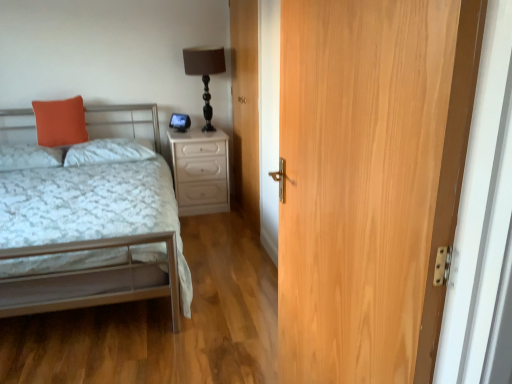
This screenshot has height=384, width=512. What do you see at coordinates (60, 122) in the screenshot? I see `orange matte pillow at upper left, arranged as the 2th pillow when viewed from the right` at bounding box center [60, 122].

I want to click on orange fabric pillow at left, placed as the 1th pillow when sorted from left to right, so click(29, 156).

The image size is (512, 384). Identify the location of light brown wood door at right, acting as the 1th door starting from the front. (370, 181).

Describe the element at coordinates (370, 181) in the screenshot. This screenshot has width=512, height=384. I see `light brown wood door at right, the second door from the left` at that location.

This screenshot has height=384, width=512. I want to click on white glossy nightstand at center, so click(200, 171).

I want to click on orange fabric pillow at left, the 3th pillow when ordered from left to right, so 106,152.

This screenshot has width=512, height=384. I want to click on matte black table lamp at upper center, so click(205, 73).

In order to click on orange matte pillow at upper left, marked as the second pillow in a left-to-right arrangement in this screenshot , I will do `click(60, 122)`.

From a real-world perspective, who is located lower, white glossy nightstand at center or orange fabric pillow at left, placed as the 1th pillow when sorted from left to right?

white glossy nightstand at center is physically lower.

Is white glossy nightstand at center positioned with its back to orange fabric pillow at left, placed as the 1th pillow when sorted from left to right?

No, white glossy nightstand at center is not facing away from orange fabric pillow at left, placed as the 1th pillow when sorted from left to right.

From the image's perspective, which one is positioned higher, white glossy nightstand at center or orange fabric pillow at left, placed as the 1th pillow when sorted from left to right?

From the image's view, orange fabric pillow at left, placed as the 1th pillow when sorted from left to right, is above.

Is white glossy nightstand at center not close to orange fabric pillow at left, placed as the 1th pillow when sorted from left to right?

That's right, there is a large distance between white glossy nightstand at center and orange fabric pillow at left, placed as the 1th pillow when sorted from left to right.

Is white glossy nightstand at center not near metallic silver bed at left?

Yes, white glossy nightstand at center and metallic silver bed at left are located far from each other.

Based on their sizes in the image, would you say white glossy nightstand at center is bigger or smaller than metallic silver bed at left?

Considering their sizes, white glossy nightstand at center takes up less space than metallic silver bed at left.

Can we say white glossy nightstand at center lies outside metallic silver bed at left?

white glossy nightstand at center lies outside metallic silver bed at left's area.

From a real-world perspective, which is physically below, white glossy nightstand at center or metallic silver bed at left?

white glossy nightstand at center is physically lower.

From a real-world perspective, between white glossy nightstand at center and light brown wood door at right, the second door from the back, who is vertically higher?

light brown wood door at right, the second door from the back.

Does point (180, 186) come closer to viewer compared to point (417, 288)?

That is False.

Is white glossy nightstand at center to the left of light brown wood door at right, acting as the 1th door starting from the front, from the viewer's perspective?

Yes, white glossy nightstand at center is to the left of light brown wood door at right, acting as the 1th door starting from the front.

Consider the image. Looking at the image, does metallic silver bed at left seem bigger or smaller compared to matte black table lamp at upper center?

In the image, metallic silver bed at left appears to be larger than matte black table lamp at upper center.

Are metallic silver bed at left and matte black table lamp at upper center located far from each other?

metallic silver bed at left is far away from matte black table lamp at upper center.

Is metallic silver bed at left wider than matte black table lamp at upper center?

Correct, the width of metallic silver bed at left exceeds that of matte black table lamp at upper center.

From a real-world perspective, which is physically above, metallic silver bed at left or matte black table lamp at upper center?

matte black table lamp at upper center is physically above.

From the image's perspective, is matte black table lamp at upper center located above or below orange matte pillow at upper left, arranged as the 2th pillow when viewed from the right?

matte black table lamp at upper center is situated higher than orange matte pillow at upper left, arranged as the 2th pillow when viewed from the right, in the image.

Is point (210, 59) closer or farther from the camera than point (44, 102)?

Point (210, 59).

Is orange matte pillow at upper left, arranged as the 2th pillow when viewed from the right, completely or partially inside matte black table lamp at upper center?

No, orange matte pillow at upper left, arranged as the 2th pillow when viewed from the right, is located outside of matte black table lamp at upper center.

From the picture: Between matte black table lamp at upper center and orange matte pillow at upper left, arranged as the 2th pillow when viewed from the right, which one has less height?

With less height is orange matte pillow at upper left, arranged as the 2th pillow when viewed from the right.

Between orange fabric pillow at left, arranged as the third pillow when viewed from the right, and metallic silver bed at left, which one is positioned behind?

orange fabric pillow at left, arranged as the third pillow when viewed from the right, is more distant.

From the image's perspective, is orange fabric pillow at left, placed as the 1th pillow when sorted from left to right, located above or below metallic silver bed at left?

Clearly, from the image's perspective, orange fabric pillow at left, placed as the 1th pillow when sorted from left to right, is above metallic silver bed at left.

Would you consider orange fabric pillow at left, placed as the 1th pillow when sorted from left to right, to be distant from metallic silver bed at left?

No, there isn't a large distance between orange fabric pillow at left, placed as the 1th pillow when sorted from left to right, and metallic silver bed at left.

Is orange fabric pillow at left, placed as the 1th pillow when sorted from left to right, taller than metallic silver bed at left?

Incorrect, the height of orange fabric pillow at left, placed as the 1th pillow when sorted from left to right, is not larger of that of metallic silver bed at left.

Are orange fabric pillow at left, marked as the first pillow in a right-to-left arrangement, and metallic silver bed at left making contact?

No, orange fabric pillow at left, marked as the first pillow in a right-to-left arrangement, is not touching metallic silver bed at left.

Is orange fabric pillow at left, marked as the first pillow in a right-to-left arrangement, situated inside metallic silver bed at left or outside?

The correct answer is: inside.

Considering the relative sizes of orange fabric pillow at left, marked as the first pillow in a right-to-left arrangement, and metallic silver bed at left in the image provided, is orange fabric pillow at left, marked as the first pillow in a right-to-left arrangement, taller than metallic silver bed at left?

No.

Is orange fabric pillow at left, marked as the first pillow in a right-to-left arrangement, smaller than metallic silver bed at left?

Indeed, orange fabric pillow at left, marked as the first pillow in a right-to-left arrangement, has a smaller size compared to metallic silver bed at left.

Locate an element on the screen. the 3rd pillow in front when counting from the white glossy nightstand at center is located at coordinates (29, 156).

At what (x,y) coordinates should I click in order to perform the action: click on bed positioned vertically above the white glossy nightstand at center (from a real-world perspective). Please return your answer as a coordinate pair (x, y). Image resolution: width=512 pixels, height=384 pixels. Looking at the image, I should click on (90, 239).

When comparing their distances from orange fabric pillow at left, marked as the first pillow in a right-to-left arrangement, does light brown wood door at center, which is the 1th door in left-to-right order, or orange matte pillow at upper left, arranged as the 2th pillow when viewed from the right, seem further?

light brown wood door at center, which is the 1th door in left-to-right order, is positioned further to the anchor orange fabric pillow at left, marked as the first pillow in a right-to-left arrangement.

Considering their positions, is light brown wood door at right, the second door from the left, positioned closer to orange fabric pillow at left, arranged as the third pillow when viewed from the right, than orange fabric pillow at left, the 3th pillow when ordered from left to right?

The object closer to orange fabric pillow at left, arranged as the third pillow when viewed from the right, is orange fabric pillow at left, the 3th pillow when ordered from left to right.

Considering their positions, is orange matte pillow at upper left, marked as the second pillow in a left-to-right arrangement, positioned closer to orange fabric pillow at left, the 3th pillow when ordered from left to right, than orange fabric pillow at left, arranged as the third pillow when viewed from the right?

orange matte pillow at upper left, marked as the second pillow in a left-to-right arrangement, is positioned closer to the anchor orange fabric pillow at left, the 3th pillow when ordered from left to right.

When comparing their distances from light brown wood door at right, the second door from the back, does orange fabric pillow at left, marked as the first pillow in a right-to-left arrangement, or matte black table lamp at upper center seem further?

matte black table lamp at upper center lies further to light brown wood door at right, the second door from the back, than the other object.

When comparing their distances from light brown wood door at center, the 2th door when ordered from right to left, does matte black table lamp at upper center or orange fabric pillow at left, marked as the first pillow in a right-to-left arrangement, seem closer?

matte black table lamp at upper center lies closer to light brown wood door at center, the 2th door when ordered from right to left, than the other object.

Based on their spatial positions, is white glossy nightstand at center or orange fabric pillow at left, placed as the 1th pillow when sorted from left to right, closer to metallic silver bed at left?

orange fabric pillow at left, placed as the 1th pillow when sorted from left to right, lies closer to metallic silver bed at left than the other object.

Which object lies nearer to the anchor point metallic silver bed at left, light brown wood door at right, which is the 1th door from right to left, or orange matte pillow at upper left, arranged as the 2th pillow when viewed from the right?

orange matte pillow at upper left, arranged as the 2th pillow when viewed from the right.

Based on their spatial positions, is light brown wood door at right, the second door from the left, or orange fabric pillow at left, arranged as the third pillow when viewed from the right, further from matte black table lamp at upper center?

The object further to matte black table lamp at upper center is light brown wood door at right, the second door from the left.

I want to click on bed between light brown wood door at right, acting as the 1th door starting from the front, and white glossy nightstand at center, along the z-axis, so click(90, 239).

Where is `nightstand between orange fabric pillow at left, marked as the first pillow in a right-to-left arrangement, and light brown wood door at center, the 2th door when ordered from right to left, from left to right`? The width and height of the screenshot is (512, 384). nightstand between orange fabric pillow at left, marked as the first pillow in a right-to-left arrangement, and light brown wood door at center, the 2th door when ordered from right to left, from left to right is located at coordinates (200, 171).

This screenshot has height=384, width=512. Find the location of `table lamp between orange matte pillow at upper left, arranged as the 2th pillow when viewed from the right, and light brown wood door at center, which is the 1th door in left-to-right order, from left to right`. table lamp between orange matte pillow at upper left, arranged as the 2th pillow when viewed from the right, and light brown wood door at center, which is the 1th door in left-to-right order, from left to right is located at coordinates (205, 73).

You are a GUI agent. You are given a task and a screenshot of the screen. Output one action in this format:
    pyautogui.click(x=<x>, y=<y>)
    Task: Click on the bed located between light brown wood door at right, which is the 1th door from right to left, and orange fabric pillow at left, the 3th pillow when ordered from left to right, in the depth direction
    
    Given the screenshot: What is the action you would take?
    pyautogui.click(x=90, y=239)